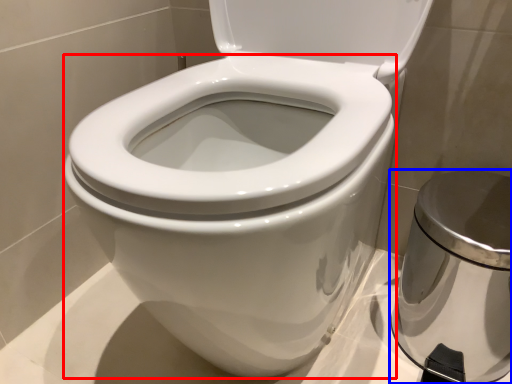
Question: Which point is closer to the camera, bidet (highlighted by a red box) or porcelain (highlighted by a blue box)?

Choices:
 (A) bidet
 (B) porcelain

Answer: (A)